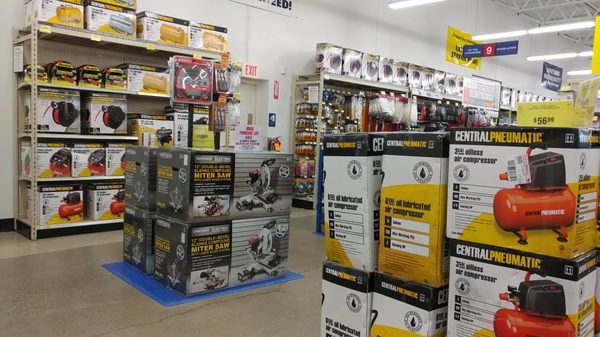
The height and width of the screenshot is (337, 600). I want to click on exit sign, so click(x=253, y=72).